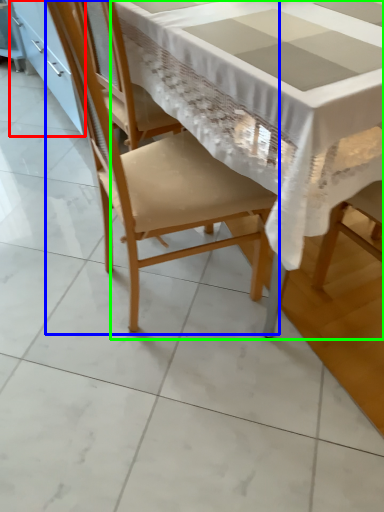
Question: Considering the real-world distances, which object is farthest from cabinetry (highlighted by a red box)? chair (highlighted by a blue box) or table (highlighted by a green box)?

Choices:
 (A) chair
 (B) table

Answer: (B)